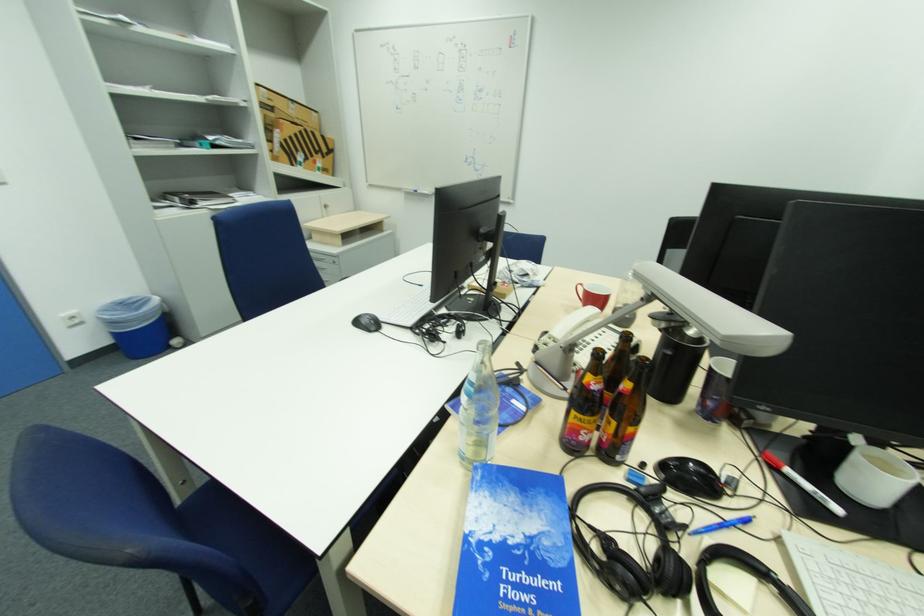
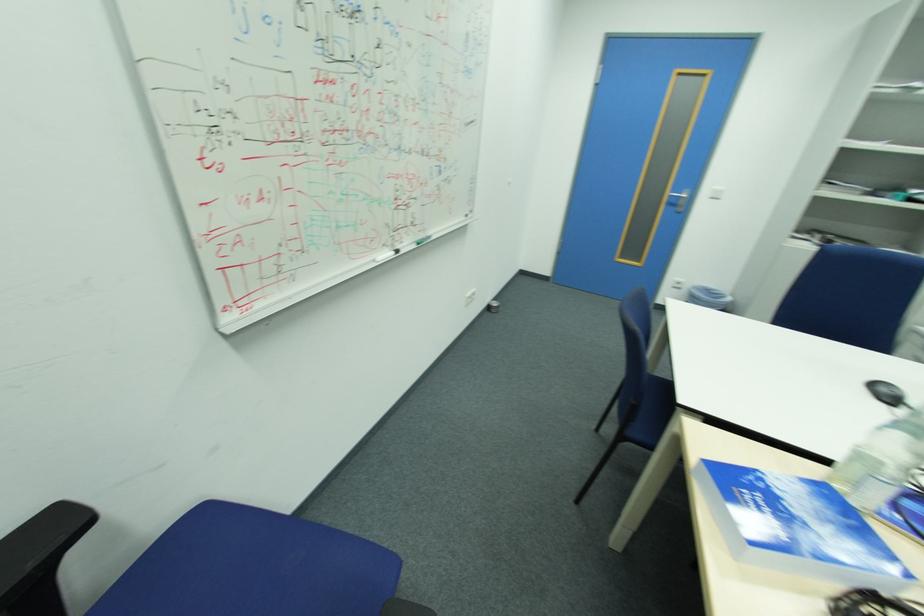
The images are taken continuously from a first-person perspective. In which direction is your viewpoint rotating?

The rotation direction of the camera is left-down.